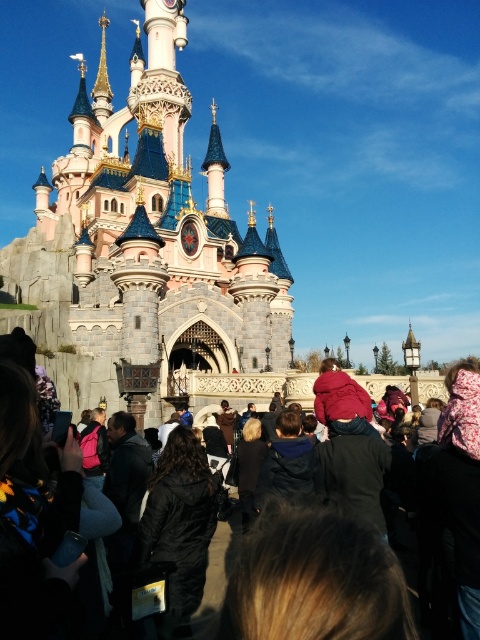
Question: Which object is positioned farthest from the dark blue jacket at center?

Choices:
 (A) black matte coat at center
 (B) black fabric crowd at center

Answer: (A)

Question: Can you confirm if black fabric crowd at center is positioned to the right of dark blue jacket at center?

Choices:
 (A) yes
 (B) no

Answer: (B)

Question: Which object is farther from the camera taking this photo?

Choices:
 (A) black matte coat at center
 (B) dark blue jacket at center

Answer: (B)

Question: Does pink stone castle at center come in front of dark blue jacket at center?

Choices:
 (A) yes
 (B) no

Answer: (B)

Question: Is black matte coat at center in front of dark blue jacket at center?

Choices:
 (A) no
 (B) yes

Answer: (B)

Question: Among these points, which one is farthest from the camera?

Choices:
 (A) (56, 328)
 (B) (287, 436)
 (C) (352, 468)

Answer: (A)